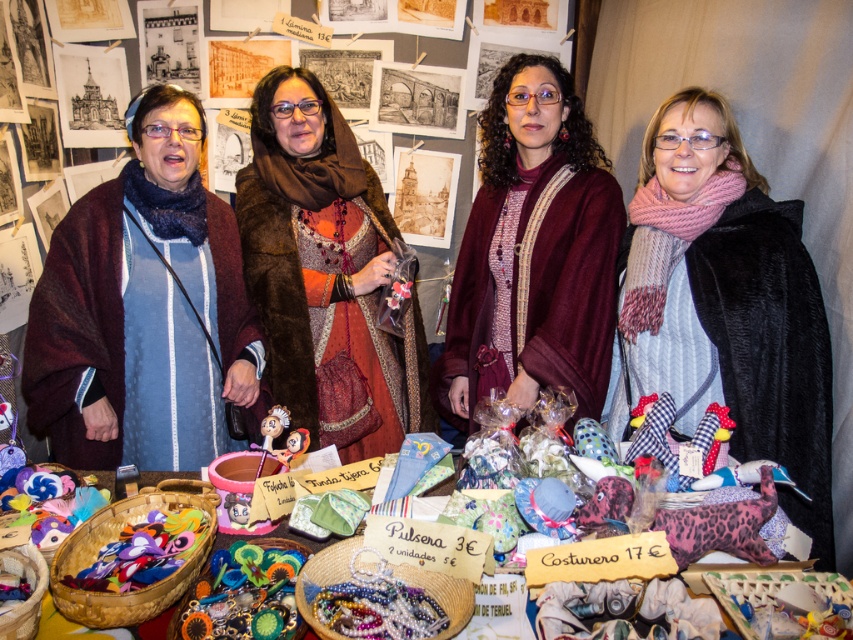
Is point (254, 392) more distant than point (695, 570)?

Yes.

Between point (177, 392) and point (384, 481), which one is positioned in front?

Point (384, 481) is in front.

Locate an element on the screen. This screenshot has width=853, height=640. maroon woolen shawl at left is located at coordinates (134, 314).

Image resolution: width=853 pixels, height=640 pixels. What are the coordinates of `maroon woolen shawl at left` in the screenshot? It's located at (134, 314).

Is brown fur coat at center positioned before brightly colored felt crafts at center?

That is False.

Can you confirm if brown fur coat at center is smaller than brightly colored felt crafts at center?

No.

The image size is (853, 640). What do you see at coordinates (323, 262) in the screenshot?
I see `brown fur coat at center` at bounding box center [323, 262].

Where is `brown fur coat at center`? brown fur coat at center is located at coordinates (323, 262).

Does pink knitted scarf at right appear on the right side of brightly colored felt crafts at center?

Correct, you'll find pink knitted scarf at right to the right of brightly colored felt crafts at center.

Can you confirm if pink knitted scarf at right is positioned above brightly colored felt crafts at center?

Indeed, pink knitted scarf at right is positioned over brightly colored felt crafts at center.

Measure the distance between pink knitted scarf at right and camera.

1.41 meters

You are a GUI agent. You are given a task and a screenshot of the screen. Output one action in this format:
    pyautogui.click(x=<x>, y=<y>)
    Task: Click on the pink knitted scarf at right
    This screenshot has height=640, width=853.
    Given the screenshot: What is the action you would take?
    click(735, 314)